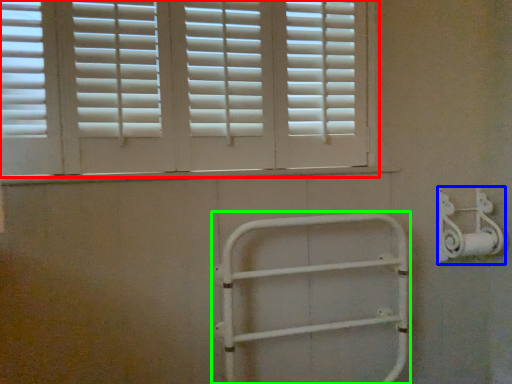
Question: Estimate the real-world distances between objects in this image. Which object is farther from window (highlighted by a red box), metal (highlighted by a blue box) or rail (highlighted by a green box)?

Choices:
 (A) metal
 (B) rail

Answer: (A)